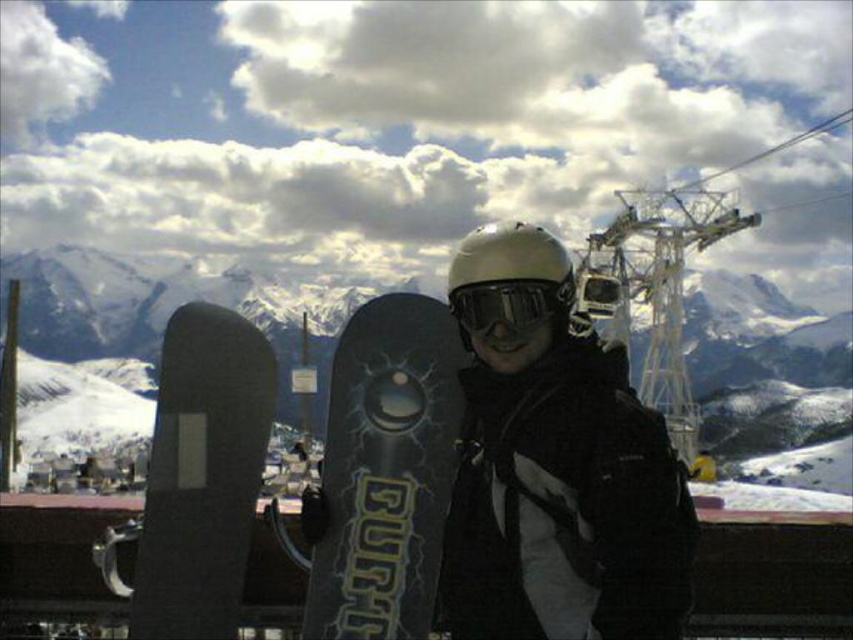
You are a photographer standing at the center of the snowy landscape. You want to take a photo that includes both the point at coordinates point (103,349) and point (515,333). Which point is closer to you, the photographer, so you can adjust your focus accordingly?

Point (103,349) is closer to you than point (515,333), so focus on that point first.